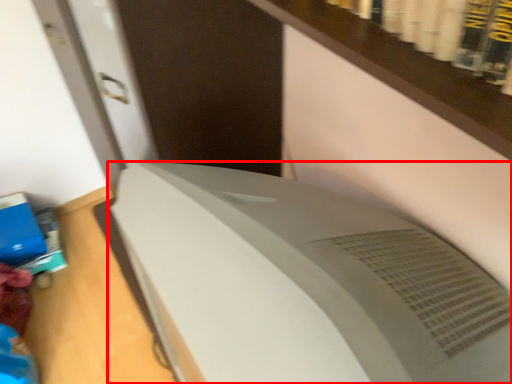
Question: Considering the relative positions of home appliance (annotated by the red box) and paperback book in the image provided, where is home appliance (annotated by the red box) located with respect to the staircase?

Choices:
 (A) right
 (B) left

Answer: (A)